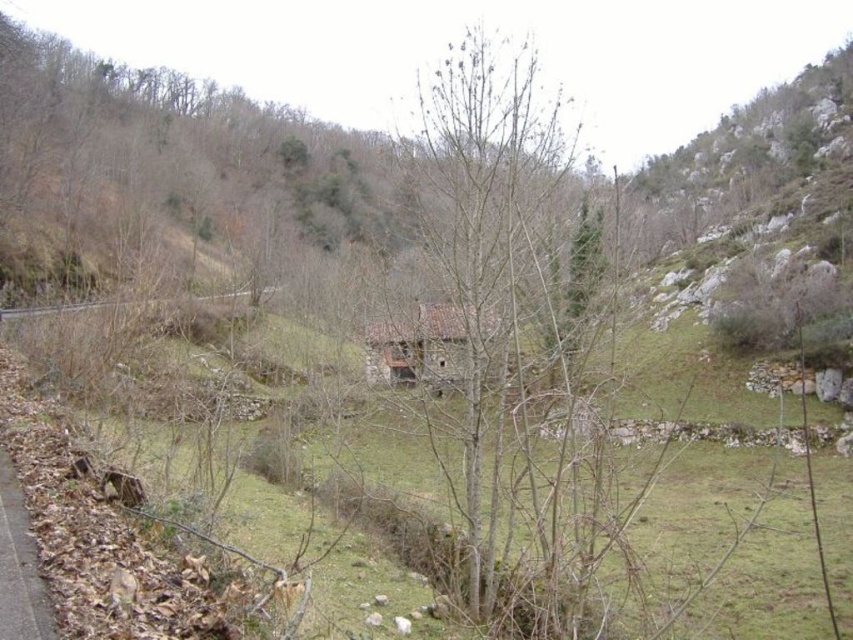
Question: Which object is closer to the camera taking this photo?

Choices:
 (A) bare wood at center
 (B) gray concrete train track at center

Answer: (A)

Question: Does brown dirt path at lower left appear on the left side of gray concrete train track at center?

Choices:
 (A) no
 (B) yes

Answer: (A)

Question: Can you confirm if brown dirt path at lower left is thinner than gray concrete train track at center?

Choices:
 (A) no
 (B) yes

Answer: (B)

Question: Which point is closer to the camera?

Choices:
 (A) bare wood at center
 (B) brown stone hut at center

Answer: (A)

Question: Which object appears closest to the camera in this image?

Choices:
 (A) brown dirt path at lower left
 (B) bare wood at center
 (C) gray concrete train track at center

Answer: (A)

Question: Is bare wood at center in front of brown dirt path at lower left?

Choices:
 (A) no
 (B) yes

Answer: (A)